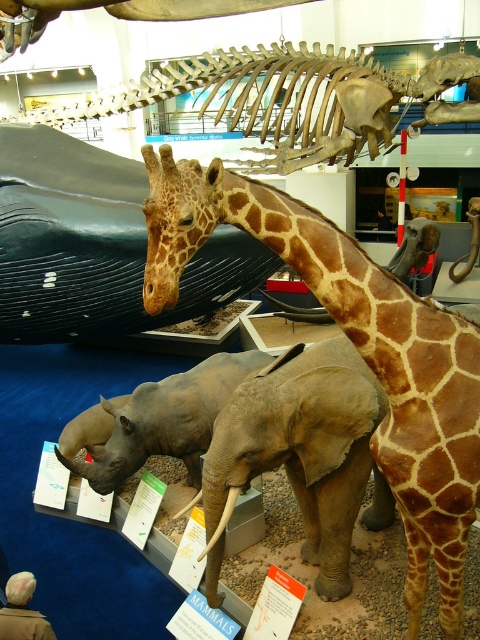
Question: Can you confirm if brown spotted giraffe at center is bigger than gray matte elephant at center?

Choices:
 (A) yes
 (B) no

Answer: (A)

Question: Which of the following is the farthest from the observer?

Choices:
 (A) gray matte elephant at center
 (B) brown spotted giraffe at center

Answer: (A)

Question: Which of the following is the closest to the observer?

Choices:
 (A) (300, 412)
 (B) (328, 305)

Answer: (B)

Question: Is brown spotted giraffe at center smaller than gray matte elephant at center?

Choices:
 (A) yes
 (B) no

Answer: (B)

Question: Is brown spotted giraffe at center below gray matte elephant at center?

Choices:
 (A) yes
 (B) no

Answer: (B)

Question: Which object appears farthest from the camera in this image?

Choices:
 (A) brown spotted giraffe at center
 (B) gray matte elephant at center

Answer: (B)